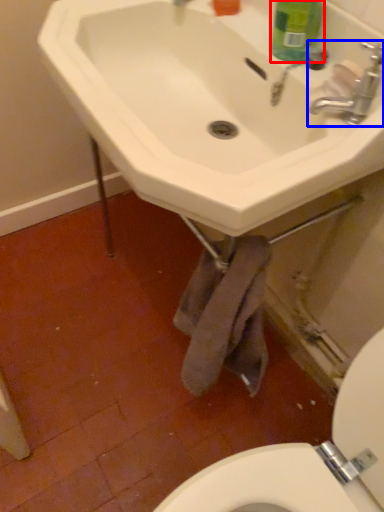
Question: Among these objects, which one is farthest to the camera, cleaning product (highlighted by a red box) or tap (highlighted by a blue box)?

Choices:
 (A) cleaning product
 (B) tap

Answer: (A)